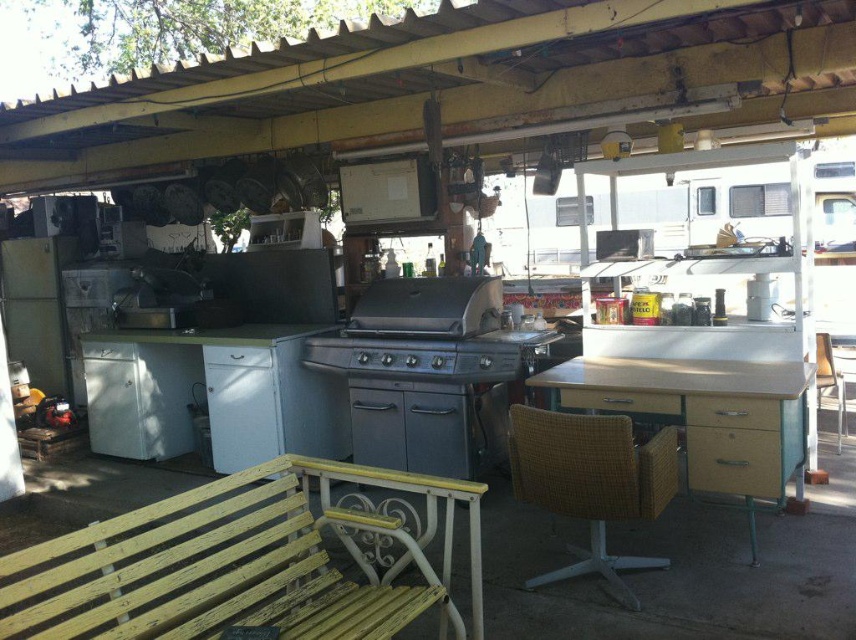
You are setting up a small outdoor event and need to seat 4 people. The yellow painted wood bench at lower left can seat 2 people. Can the woven wood chair at right accommodate the remaining 2 guests?

The yellow painted wood bench at lower left is wider than the woven wood chair at right, so the chair can only seat 1 person. Therefore, the remaining 2 guests cannot be accommodated by the woven wood chair at right alone.

You are a customer looking for a place to sit. You see the yellow painted wood bench at lower left and the woven brown chair at center. Which seating option is closer to you?

The yellow painted wood bench at lower left is closer to you because it is in front of the woven brown chair at center.